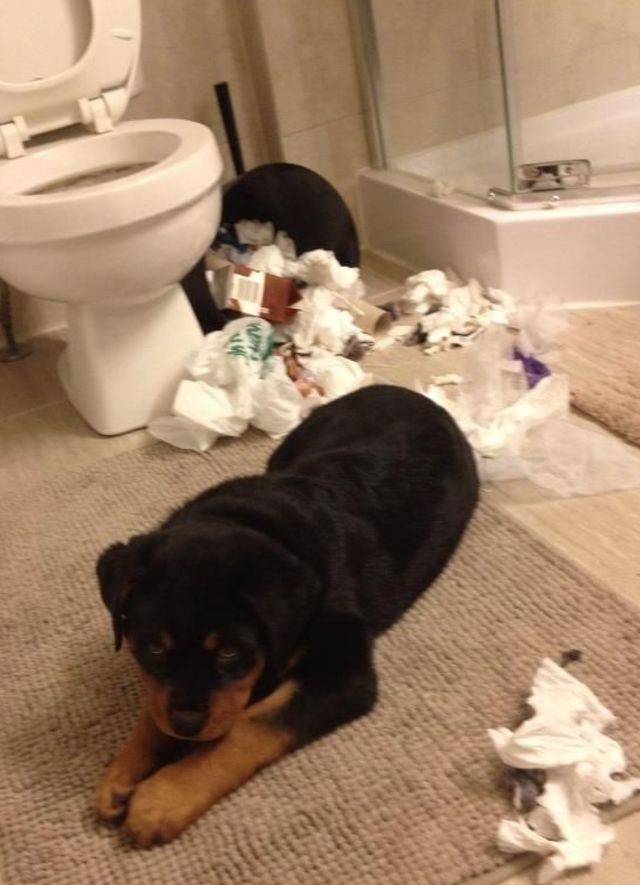
Locate an element on the screen. The height and width of the screenshot is (885, 640). toilet lid is located at coordinates (40, 22).